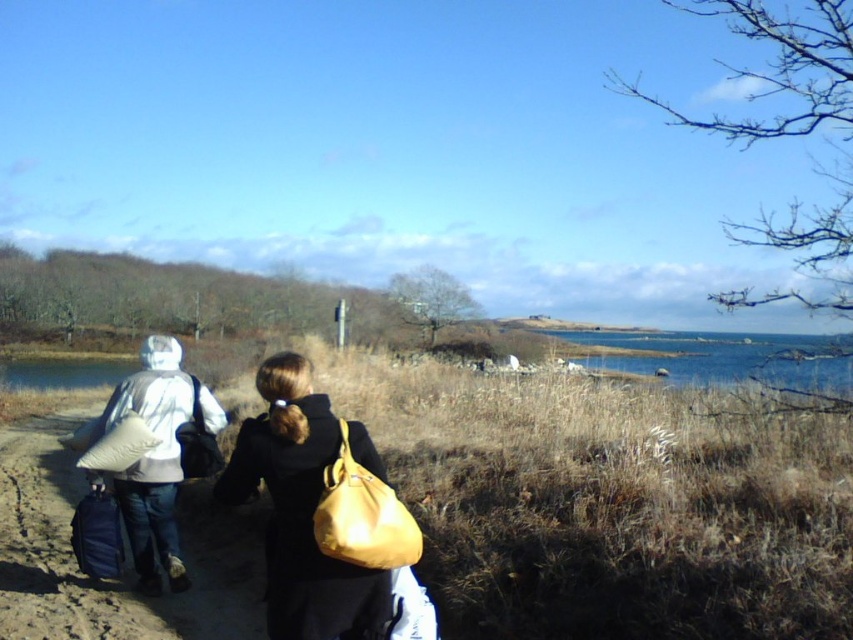
You are standing at the camera position and want to throw a small ball to hit both the point at [675,339] and the point at [375,483]. Which point should you aim for first if you want to hit them in order from closest to farthest?

You should aim for the point at [375,483] first because it is closer to you than the point at [675,339], which is further away.

You are standing at the starting point and see the blue water at right and the matte yellow bag at center. Which object is located to the right of the other?

The blue water at right is positioned on the right side of matte yellow bag at center, so the blue water at right is to the right of the matte yellow bag at center.

You are planning to take a photo of the blue water at right and the matte yellow bag at center. Which object should you focus on if you want to capture the larger one in your shot?

The blue water at right is bigger than the matte yellow bag at center, so you should focus on the blue water at right to capture the larger object in your photo.